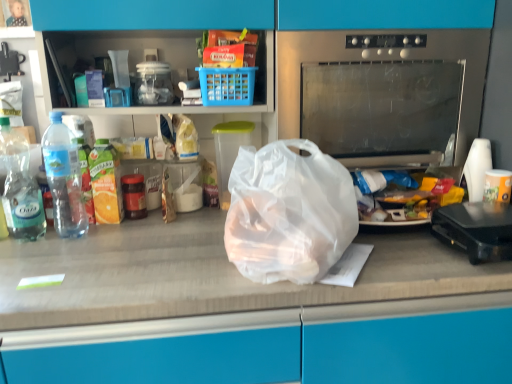
Question: From the image's perspective, would you say black plastic toaster at right is positioned over transparent plastic bag at center?

Choices:
 (A) no
 (B) yes

Answer: (A)

Question: Considering the relative sizes of black plastic toaster at right and transparent plastic bag at center in the image provided, is black plastic toaster at right thinner than transparent plastic bag at center?

Choices:
 (A) yes
 (B) no

Answer: (A)

Question: From the image's perspective, would you say black plastic toaster at right is shown under transparent plastic bag at center?

Choices:
 (A) no
 (B) yes

Answer: (B)

Question: Is transparent plastic bag at center located within black plastic toaster at right?

Choices:
 (A) no
 (B) yes

Answer: (A)

Question: Can you confirm if black plastic toaster at right is taller than transparent plastic bag at center?

Choices:
 (A) yes
 (B) no

Answer: (B)

Question: Is black plastic toaster at right located outside transparent plastic bag at center?

Choices:
 (A) no
 (B) yes

Answer: (B)

Question: From the image's perspective, is clear plastic bottle at left, which is counted as the second bottle, starting from the left, under transparent plastic bag at center?

Choices:
 (A) no
 (B) yes

Answer: (A)

Question: Does clear plastic bottle at left, which is counted as the second bottle, starting from the left, have a lesser width compared to transparent plastic bag at center?

Choices:
 (A) no
 (B) yes

Answer: (B)

Question: From a real-world perspective, is clear plastic bottle at left, positioned as the first bottle in right-to-left order, physically above transparent plastic bag at center?

Choices:
 (A) no
 (B) yes

Answer: (B)

Question: Is clear plastic bottle at left, which is counted as the second bottle, starting from the left, shorter than transparent plastic bag at center?

Choices:
 (A) no
 (B) yes

Answer: (A)

Question: From a real-world perspective, is clear plastic bottle at left, positioned as the first bottle in right-to-left order, physically below transparent plastic bag at center?

Choices:
 (A) no
 (B) yes

Answer: (A)

Question: Can you confirm if clear plastic bottle at left, which is counted as the second bottle, starting from the left, is taller than transparent plastic bag at center?

Choices:
 (A) yes
 (B) no

Answer: (A)

Question: From the image's perspective, does black plastic toaster at right appear higher than transparent plastic container at center?

Choices:
 (A) no
 (B) yes

Answer: (A)